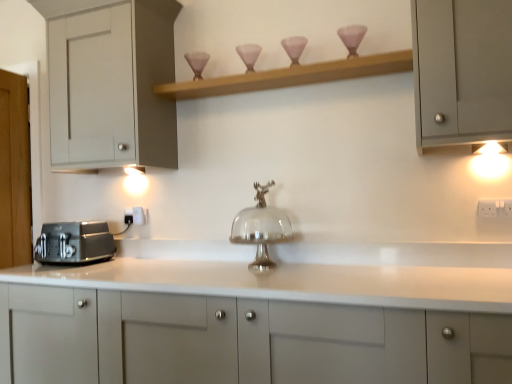
Question: From a real-world perspective, is white glossy cabinet at center, which ranks as the third cabinetry in top-to-bottom order, beneath wooden shelf at upper center?

Choices:
 (A) yes
 (B) no

Answer: (A)

Question: Is white glossy cabinet at center, the first cabinetry when ordered from bottom to top, positioned behind wooden shelf at upper center?

Choices:
 (A) no
 (B) yes

Answer: (A)

Question: From the image's perspective, would you say white glossy cabinet at center, the first cabinetry when ordered from bottom to top, is positioned over wooden shelf at upper center?

Choices:
 (A) yes
 (B) no

Answer: (B)

Question: Considering the relative sizes of white glossy cabinet at center, the first cabinetry when ordered from bottom to top, and wooden shelf at upper center in the image provided, is white glossy cabinet at center, the first cabinetry when ordered from bottom to top, smaller than wooden shelf at upper center?

Choices:
 (A) no
 (B) yes

Answer: (A)

Question: Does white glossy cabinet at center, which ranks as the third cabinetry in top-to-bottom order, have a lesser width compared to wooden shelf at upper center?

Choices:
 (A) yes
 (B) no

Answer: (B)

Question: Is point (10, 354) closer or farther from the camera than point (477, 162)?

Choices:
 (A) closer
 (B) farther

Answer: (B)

Question: From the image's perspective, is white glossy cabinet at center, which ranks as the third cabinetry in top-to-bottom order, located above or below warm matte light fixture at upper right?

Choices:
 (A) above
 (B) below

Answer: (B)

Question: Is white glossy cabinet at center, the first cabinetry when ordered from bottom to top, bigger or smaller than warm matte light fixture at upper right?

Choices:
 (A) big
 (B) small

Answer: (A)

Question: Considering the relative positions of white glossy cabinet at center, which ranks as the third cabinetry in top-to-bottom order, and warm matte light fixture at upper right in the image provided, is white glossy cabinet at center, which ranks as the third cabinetry in top-to-bottom order, to the left or to the right of warm matte light fixture at upper right?

Choices:
 (A) right
 (B) left

Answer: (B)

Question: From their relative heights in the image, would you say white plastic electric outlet at center, the first electric outlet viewed from the back, is taller or shorter than matte gray cabinet at upper right, the second cabinetry when ordered from bottom to top?

Choices:
 (A) tall
 (B) short

Answer: (B)

Question: Looking at the image, does white plastic electric outlet at center, which is the second electric outlet in front-to-back order, seem bigger or smaller compared to matte gray cabinet at upper right, acting as the second cabinetry starting from the top?

Choices:
 (A) small
 (B) big

Answer: (A)

Question: From a real-world perspective, is white plastic electric outlet at center, the first electric outlet viewed from the back, above or below matte gray cabinet at upper right, acting as the second cabinetry starting from the top?

Choices:
 (A) above
 (B) below

Answer: (B)

Question: From the image's perspective, is white plastic electric outlet at center, which is the second electric outlet in front-to-back order, above or below matte gray cabinet at upper right, acting as the second cabinetry starting from the top?

Choices:
 (A) below
 (B) above

Answer: (A)

Question: In terms of width, does matte black toaster at left look wider or thinner when compared to matte glass candle holder at upper center?

Choices:
 (A) thin
 (B) wide

Answer: (B)

Question: Choose the correct answer: Is matte black toaster at left inside matte glass candle holder at upper center or outside it?

Choices:
 (A) inside
 (B) outside

Answer: (B)